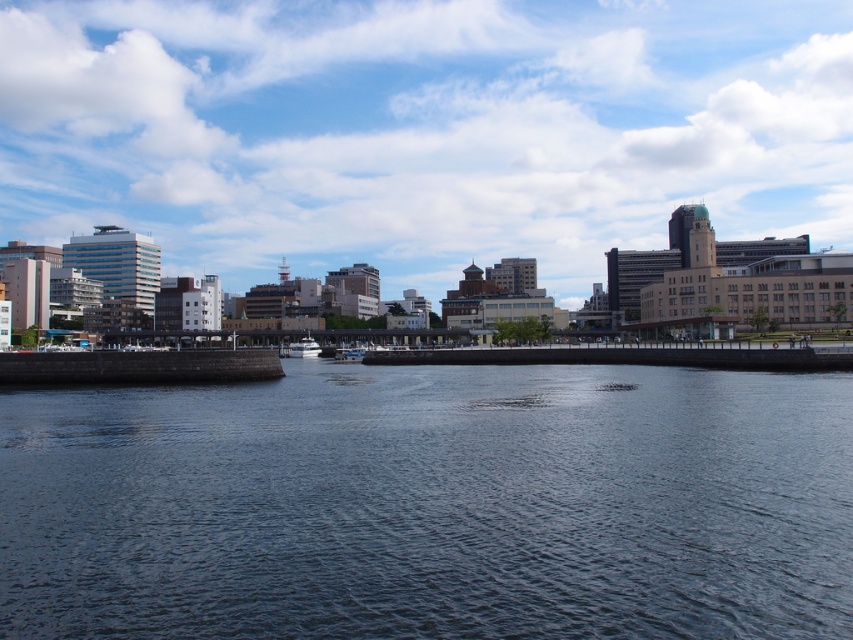
Who is more distant from viewer, (399,468) or (579,166)?

The point (579,166) is more distant.

The width and height of the screenshot is (853, 640). What are the coordinates of `dark gray water at center` in the screenshot? It's located at (431, 504).

Does point (396, 524) come farther from viewer compared to point (793, 93)?

That is False.

You are a GUI agent. You are given a task and a screenshot of the screen. Output one action in this format:
    pyautogui.click(x=<x>, y=<y>)
    Task: Click on the dark gray water at center
    Image resolution: width=853 pixels, height=640 pixels.
    Given the screenshot: What is the action you would take?
    pyautogui.click(x=431, y=504)

Who is positioned more to the left, blue sky at upper center or white glossy boat at center?

white glossy boat at center is more to the left.

This screenshot has width=853, height=640. Identify the location of blue sky at upper center. (422, 131).

This screenshot has height=640, width=853. I want to click on blue sky at upper center, so click(422, 131).

Which is more to the left, dark gray water at center or white glossy boat at center?

A: white glossy boat at center

Is dark gray water at center to the right of white glossy boat at center from the viewer's perspective?

Indeed, dark gray water at center is positioned on the right side of white glossy boat at center.

Where is `dark gray water at center`? This screenshot has height=640, width=853. dark gray water at center is located at coordinates (431, 504).